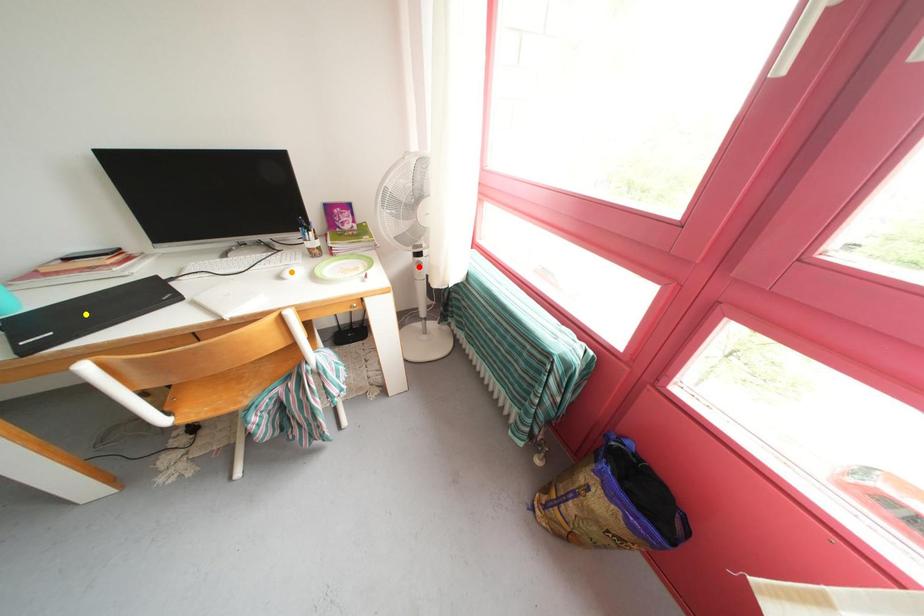
Order these from nearest to farthest:
A) yellow point
B) orange point
C) red point

yellow point < orange point < red point